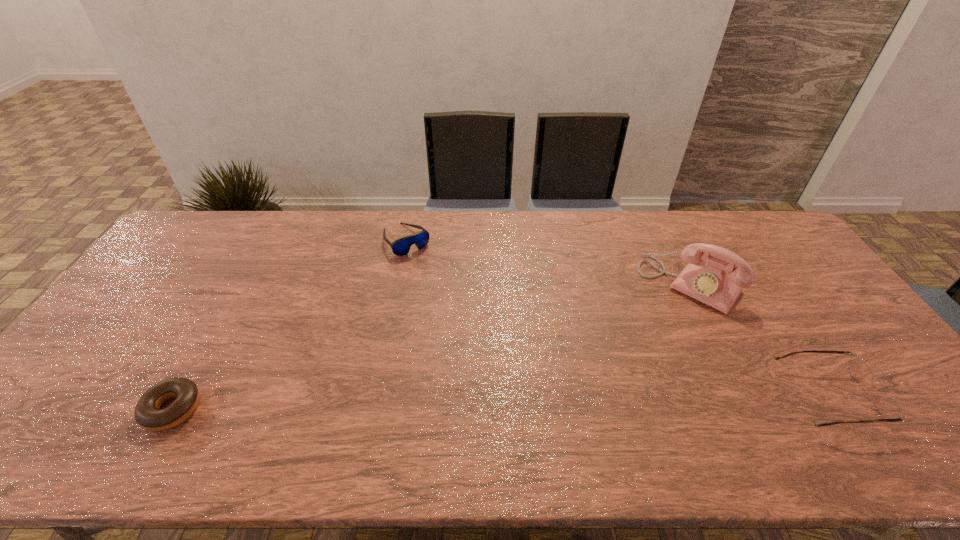
Locate an element on the screen. The width and height of the screenshot is (960, 540). vacant region that satisfies the following two spatial constraints: 1. on the front side of the sunglasses; 2. on the right side of the telephone is located at coordinates (397, 284).

Where is `vacant area that satisfies the following two spatial constraints: 1. on the front side of the spectacles; 2. on the front-facing side of the third object from right to left`? The height and width of the screenshot is (540, 960). vacant area that satisfies the following two spatial constraints: 1. on the front side of the spectacles; 2. on the front-facing side of the third object from right to left is located at coordinates pos(375,397).

Locate an element on the screen. vacant region that satisfies the following two spatial constraints: 1. on the back side of the sunglasses; 2. on the left side of the shortest object is located at coordinates (268, 240).